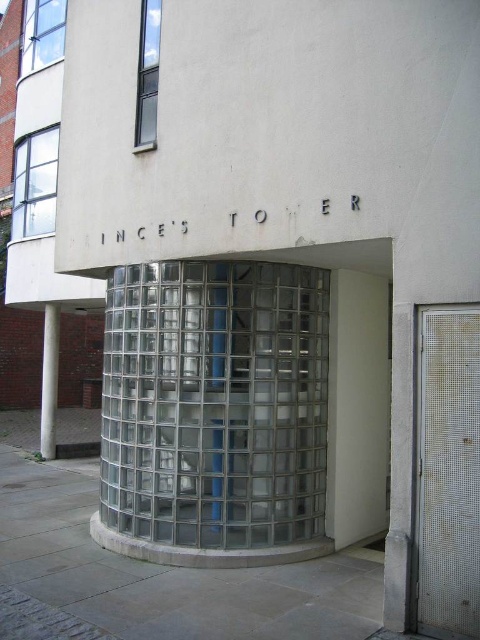
Question: Can you confirm if metal mesh door at lower right is positioned above white marble column at left?

Choices:
 (A) yes
 (B) no

Answer: (A)

Question: Which is nearer to the metal mesh door at lower right?

Choices:
 (A) white marble column at left
 (B) clear glass door at center

Answer: (B)

Question: Does metal mesh door at lower right have a lesser width compared to white marble column at left?

Choices:
 (A) no
 (B) yes

Answer: (B)

Question: Which point is closer to the camera?

Choices:
 (A) white marble column at left
 (B) metal mesh door at lower right

Answer: (B)

Question: Is metal mesh door at lower right bigger than white marble column at left?

Choices:
 (A) yes
 (B) no

Answer: (B)

Question: Which object appears farthest from the camera in this image?

Choices:
 (A) clear glass door at center
 (B) metal mesh door at lower right
 (C) white marble column at left

Answer: (C)